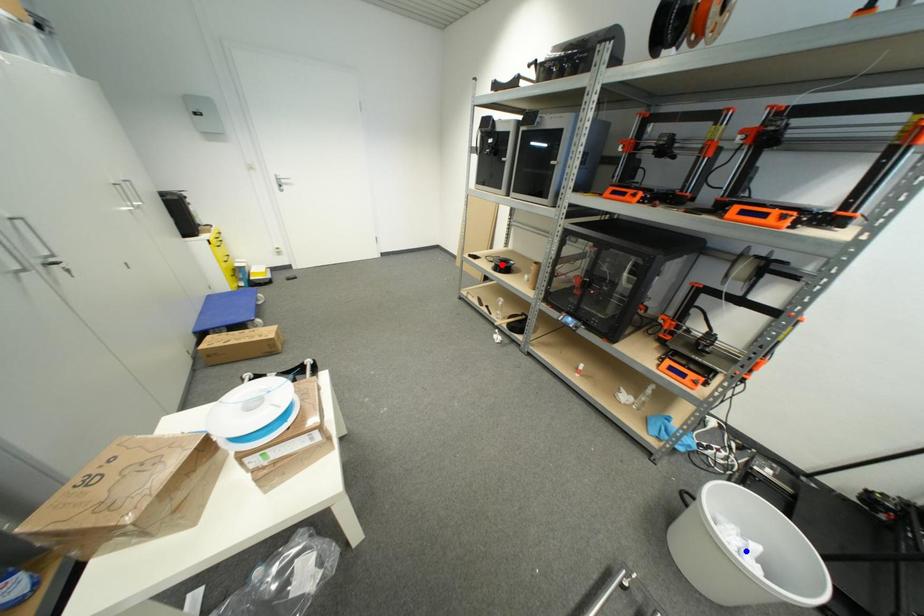
Question: Which of the two points in the image is closer to the camera?

Choices:
 (A) Blue point is closer.
 (B) Red point is closer.

Answer: (A)